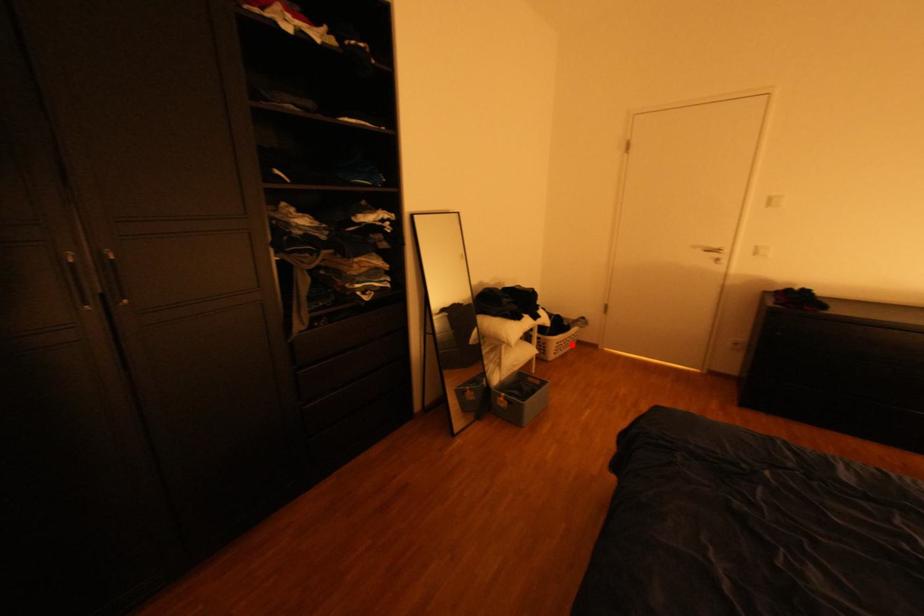
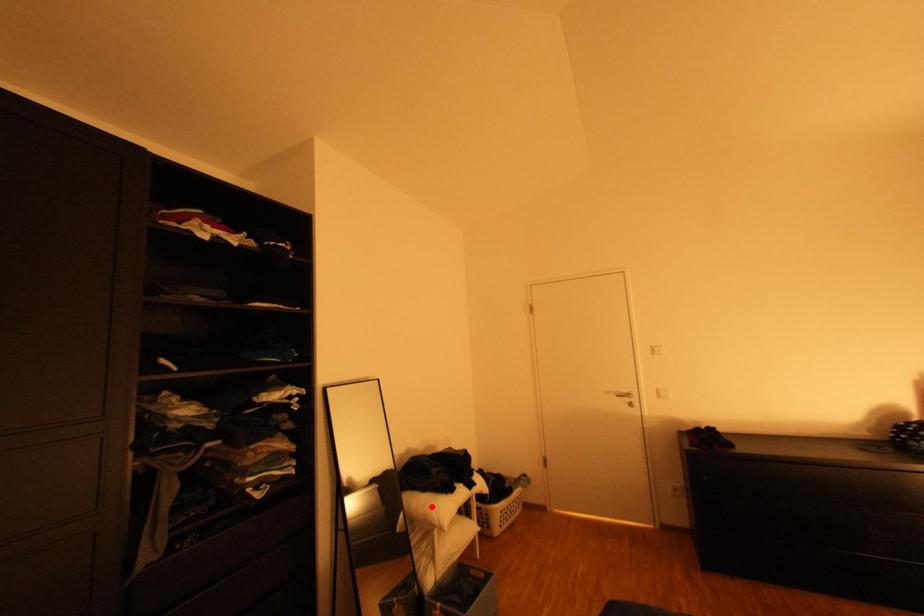
I am providing you with two images of the same scene from different viewpoints. A red point is marked on the first image and another point is marked on the second image. Is the marked point in image1 the same physical position as the marked point in image2?

No